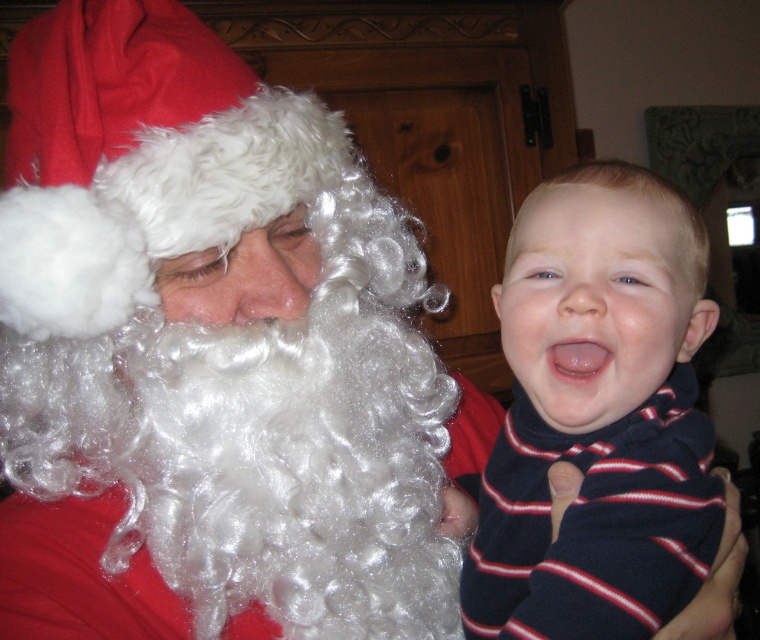
Question: Which object is closer to the camera taking this photo?

Choices:
 (A) white curly wig at upper left
 (B) white curly hair at left

Answer: (A)

Question: Which is nearer to the white curly wig at upper left?

Choices:
 (A) blue striped sweater at center
 (B) white curly hair at left

Answer: (B)

Question: Which point is closer to the camera?

Choices:
 (A) (119, 364)
 (B) (342, 406)
 (C) (676, 205)

Answer: (C)

Question: Does white curly wig at upper left have a smaller size compared to white curly hair at left?

Choices:
 (A) yes
 (B) no

Answer: (B)

Question: Does white curly wig at upper left lie in front of white curly hair at left?

Choices:
 (A) yes
 (B) no

Answer: (A)

Question: Does white curly hair at left have a smaller size compared to blue striped sweater at center?

Choices:
 (A) yes
 (B) no

Answer: (B)